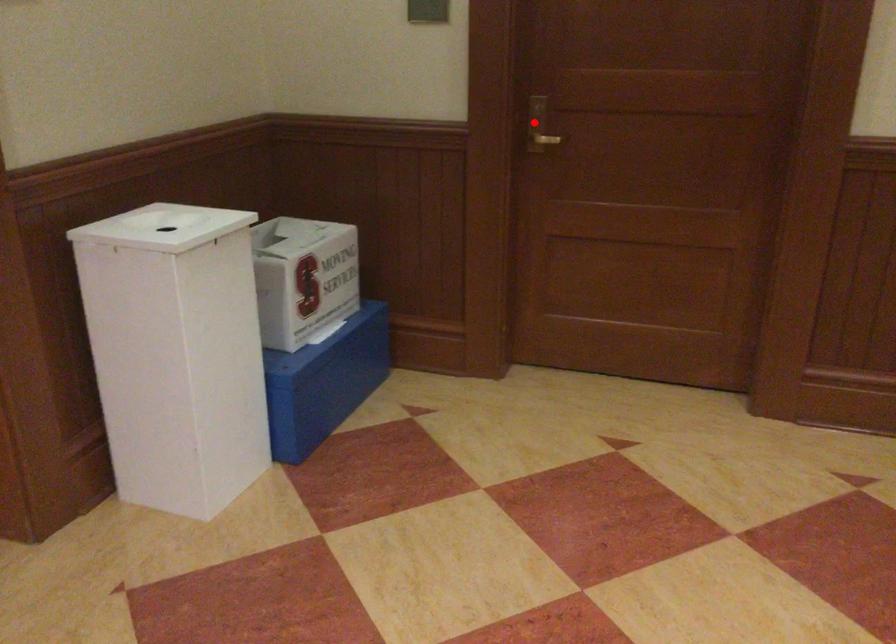
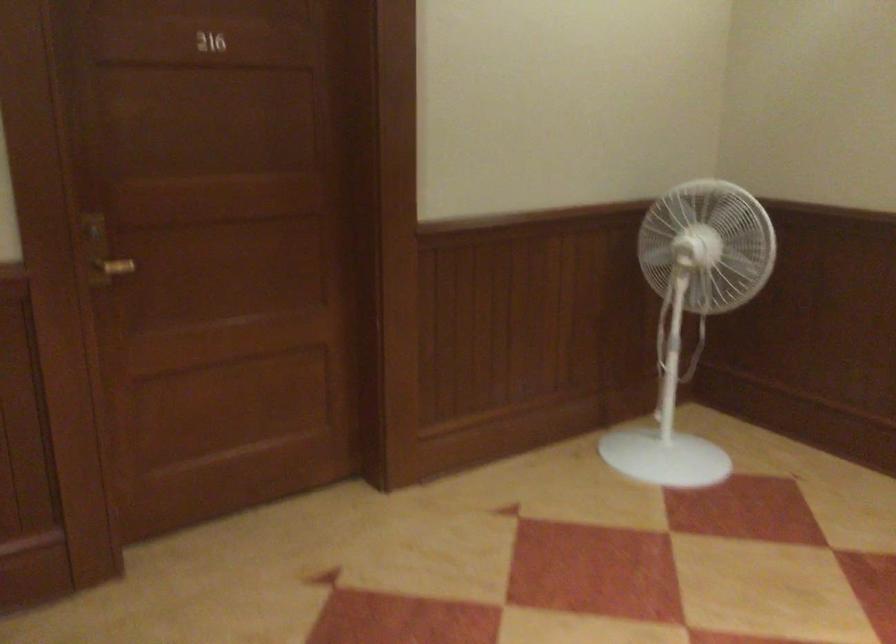
In the second image, find the point that corresponds to the highlighted location in the first image.

(101, 252)